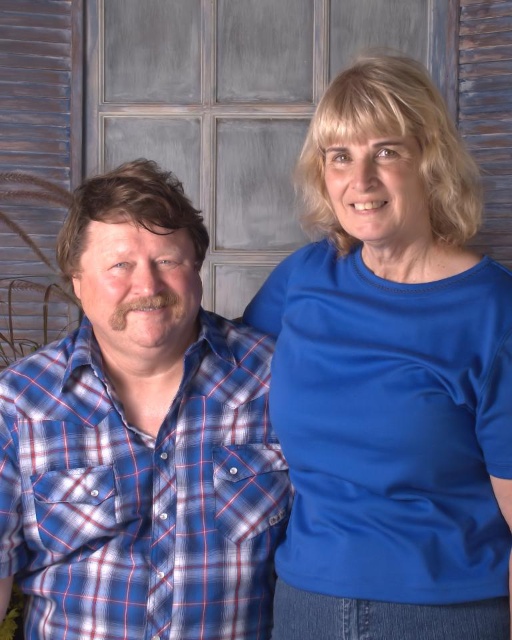
Question: Which point is farther to the camera?

Choices:
 (A) (437, 545)
 (B) (131, 541)

Answer: (B)

Question: Does blue smooth shirt at upper right come in front of blue plaid shirt at left?

Choices:
 (A) no
 (B) yes

Answer: (B)

Question: Can you confirm if blue smooth shirt at upper right is thinner than blue plaid shirt at left?

Choices:
 (A) yes
 (B) no

Answer: (A)

Question: Is blue smooth shirt at upper right wider than blue plaid shirt at left?

Choices:
 (A) yes
 (B) no

Answer: (B)